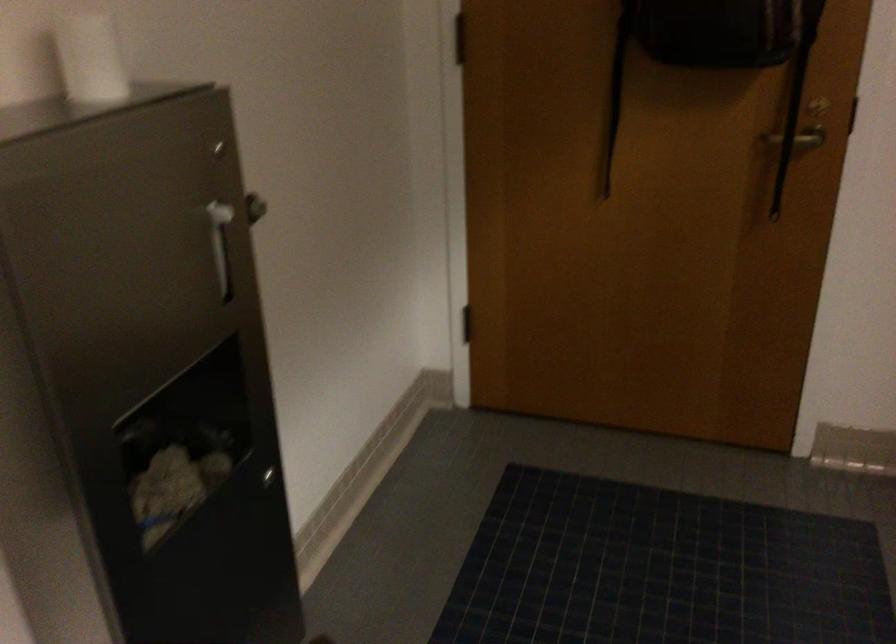
Describe the element at coordinates (798, 138) in the screenshot. I see `a brown door handle` at that location.